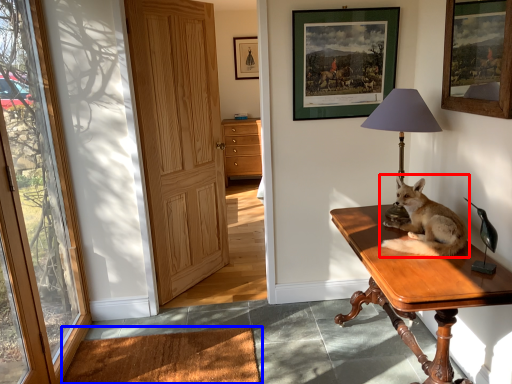
Question: Which point is closer to the camera, dog (highlighted by a red box) or mat (highlighted by a blue box)?

Choices:
 (A) dog
 (B) mat

Answer: (A)